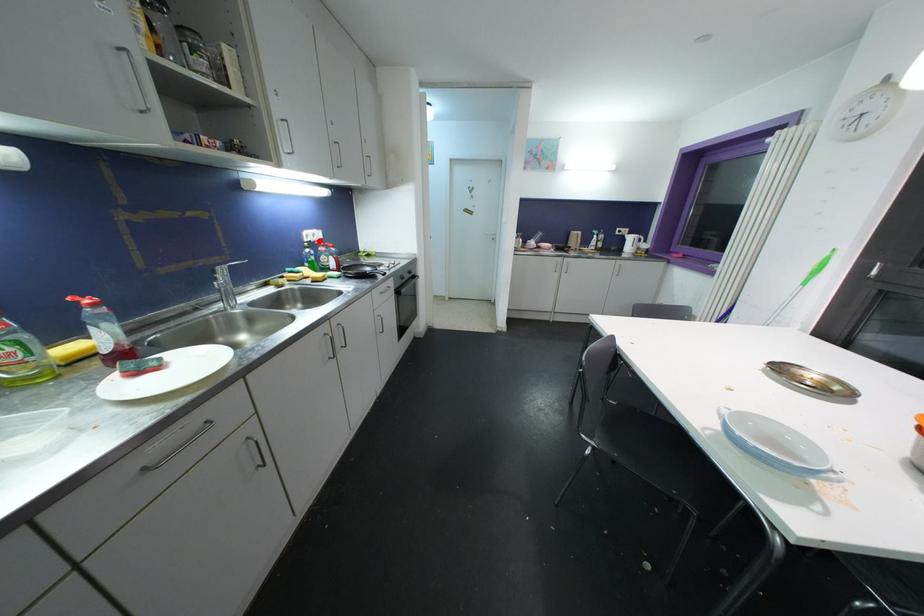
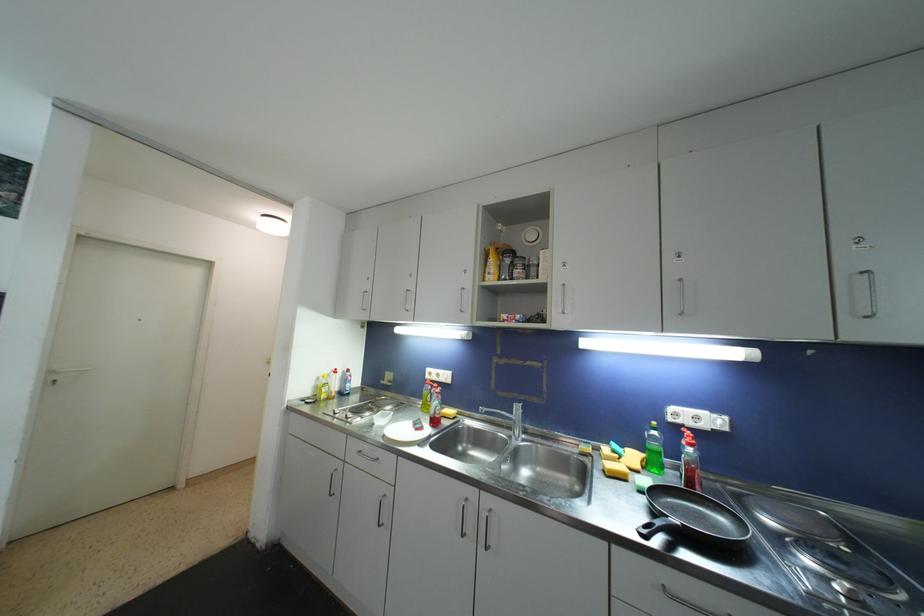
Locate, in the second image, the point that corresponds to the highlighted location in the first image.

(708, 429)